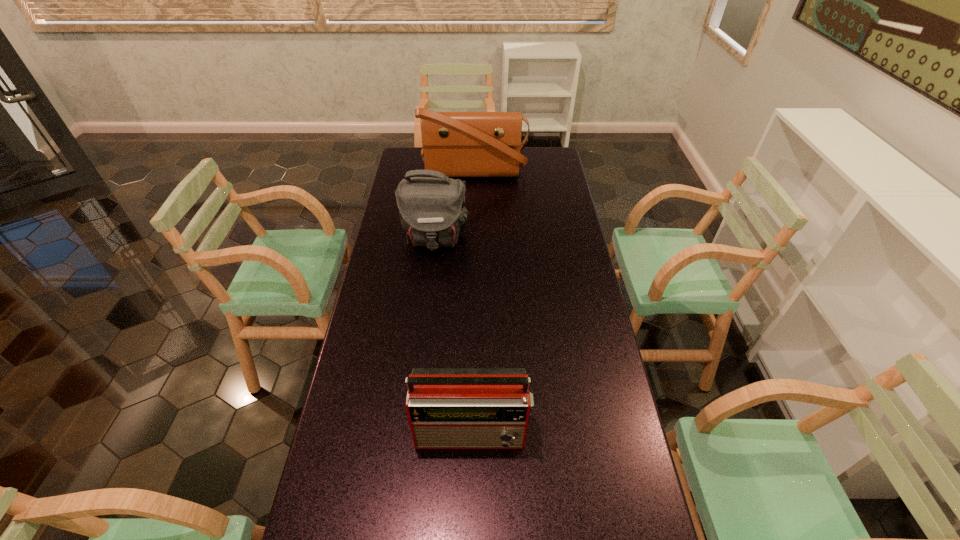
This screenshot has width=960, height=540. In the image, there is a desktop. Find the location of `vacant space at the left edge`. vacant space at the left edge is located at coordinates (348, 430).

Where is `vacant position at the right edge of the desktop`? The image size is (960, 540). vacant position at the right edge of the desktop is located at coordinates (565, 220).

Image resolution: width=960 pixels, height=540 pixels. What are the coordinates of `vacant space at the far right corner of the desktop` in the screenshot? It's located at pos(527,158).

Identify the location of free space between the farthest object and the nearest object. (473, 302).

Locate an element on the screen. The height and width of the screenshot is (540, 960). vacant area that lies between the radio receiver and the farthest object is located at coordinates (473, 302).

Where is `vacant area that lies between the radio receiver and the shoulder bag`? This screenshot has height=540, width=960. vacant area that lies between the radio receiver and the shoulder bag is located at coordinates (454, 335).

I want to click on vacant space that's between the second farthest object and the radio receiver, so click(x=454, y=335).

This screenshot has width=960, height=540. I want to click on object that can be found as the second closest to the shoulder bag, so click(x=448, y=408).

Identify the location of the closest object to the second nearest object. (458, 144).